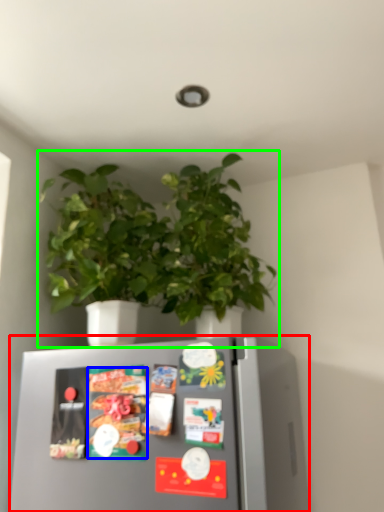
Question: Which object is the farthest from refrigerator (highlighted by a red box)? Choose among these: food (highlighted by a blue box) or houseplant (highlighted by a green box).

Choices:
 (A) food
 (B) houseplant

Answer: (B)